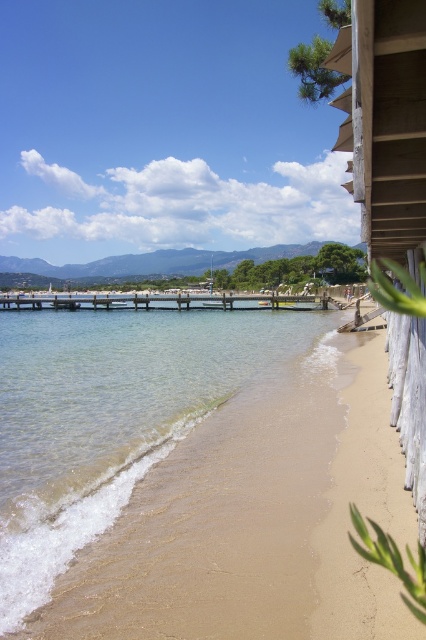
Is clear water at lower left thinner than wooden pier at center?

Yes, clear water at lower left is thinner than wooden pier at center.

Who is higher up, clear water at lower left or wooden pier at center?

wooden pier at center is above.

Is point (14, 609) behind point (290, 305)?

No, (14, 609) is in front of (290, 305).

The image size is (426, 640). Identify the location of clear water at lower left. (106, 417).